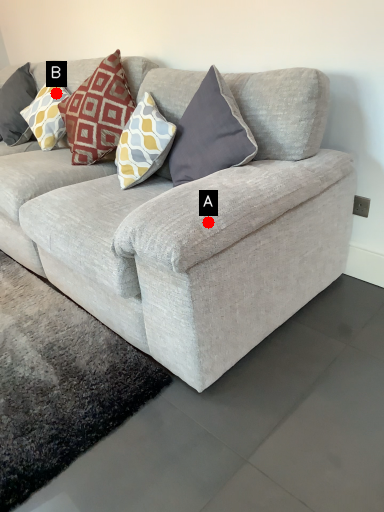
Question: Two points are circled on the image, labeled by A and B beside each circle. Which point is closer to the camera?

Choices:
 (A) A is closer
 (B) B is closer

Answer: (A)